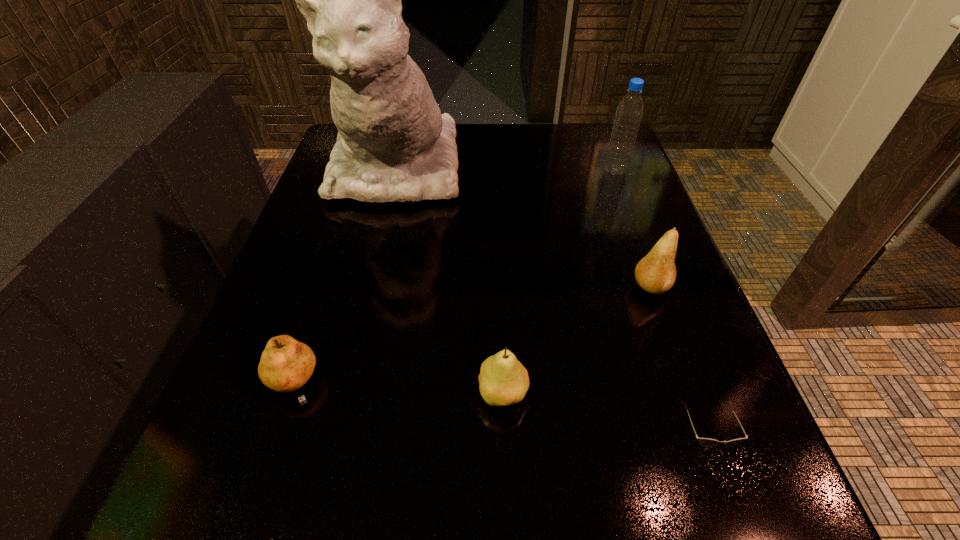
Find the location of `free space located 0.090m on the front of the farthest pear`. free space located 0.090m on the front of the farthest pear is located at coordinates (671, 345).

Locate an element on the screen. The image size is (960, 540). vacant area located 0.290m on the back of the fourth object from right to left is located at coordinates (497, 245).

Locate an element on the screen. This screenshot has height=540, width=960. vacant space located on the right of the fifth tallest object is located at coordinates pos(571,386).

Where is `cat that is at the far edge`? This screenshot has width=960, height=540. cat that is at the far edge is located at coordinates (x=393, y=144).

This screenshot has height=540, width=960. Find the location of `water bottle at the far edge`. water bottle at the far edge is located at coordinates (629, 112).

You are a GUI agent. You are given a task and a screenshot of the screen. Output one action in this format:
    pyautogui.click(x=<x>, y=<y>)
    Task: Click on the cat present at the left edge
    The height and width of the screenshot is (540, 960).
    Given the screenshot: What is the action you would take?
    pyautogui.click(x=393, y=144)

The height and width of the screenshot is (540, 960). Identify the location of pear present at the left edge. (286, 365).

Where is `water bottle that is at the right edge`? The height and width of the screenshot is (540, 960). water bottle that is at the right edge is located at coordinates (629, 112).

The width and height of the screenshot is (960, 540). I want to click on pear that is at the right edge, so click(x=655, y=273).

This screenshot has width=960, height=540. Identify the location of sunglasses that is at the right edge. (706, 442).